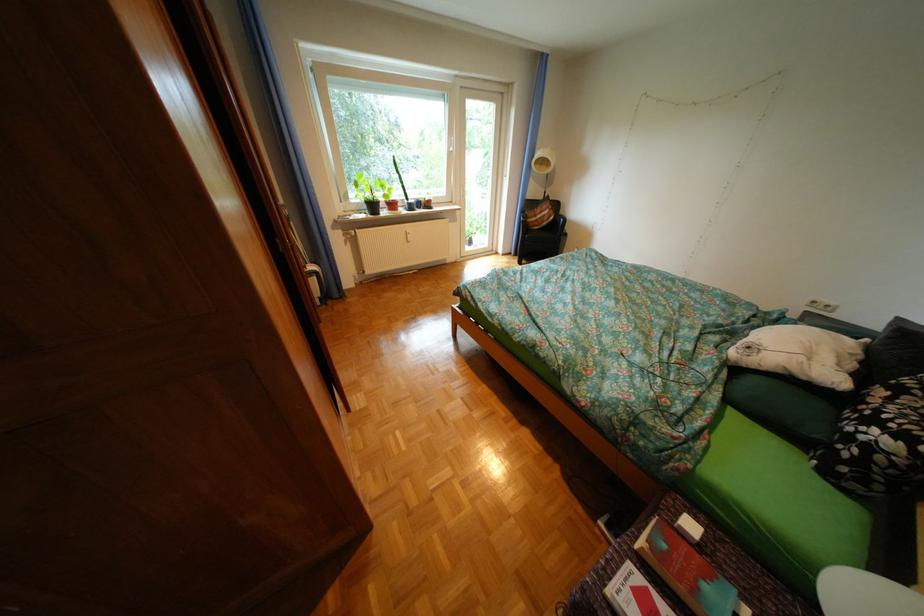
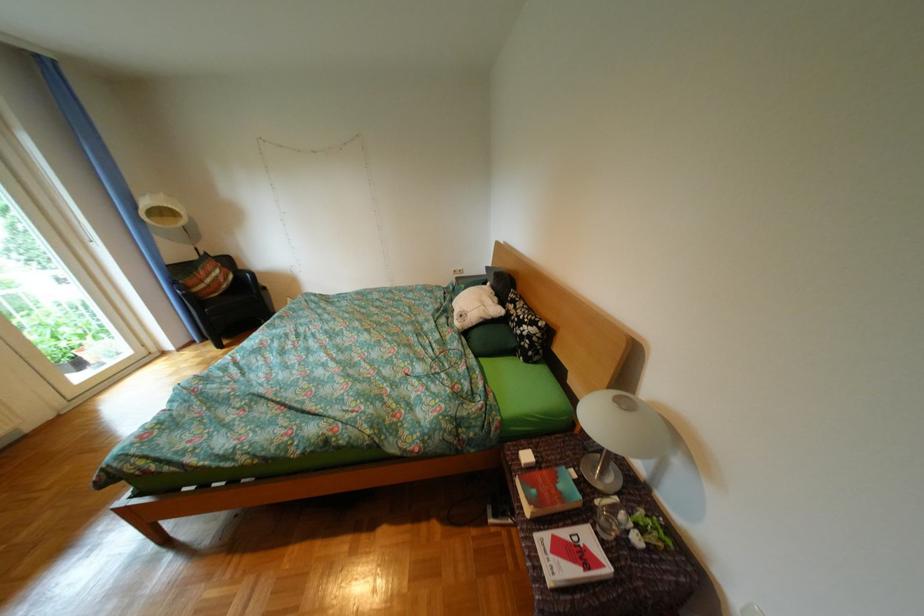
Question: The camera is either moving clockwise (left) or counter-clockwise (right) around the object. The first image is from the beginning of the video and the second image is from the end. Is the camera moving left or right when shooting the video?

Choices:
 (A) Left
 (B) Right

Answer: (A)